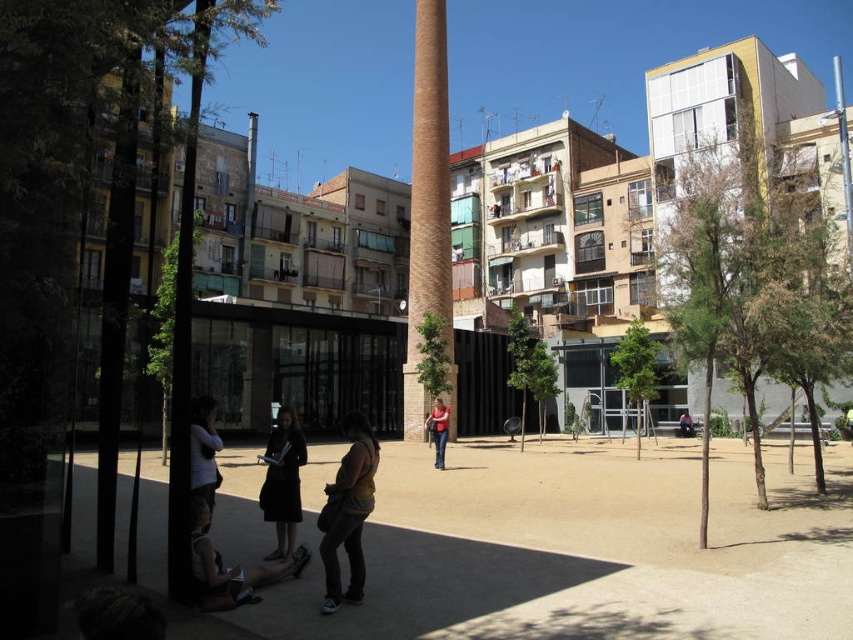
Does dark brown leather shoes at lower center have a lesser height compared to dark matte dress at center?

Indeed, dark brown leather shoes at lower center has a lesser height compared to dark matte dress at center.

Is dark brown leather shoes at lower center taller than dark matte dress at center?

No, dark brown leather shoes at lower center is not taller than dark matte dress at center.

Between point (305, 552) and point (293, 445), which one is positioned behind?

The point (293, 445) is behind.

Where is `dark brown leather shoes at lower center`? This screenshot has height=640, width=853. dark brown leather shoes at lower center is located at coordinates (231, 566).

Does dark brown leather jacket at center appear over dark matte dress at center?

Indeed, dark brown leather jacket at center is positioned over dark matte dress at center.

Where is `dark brown leather jacket at center`? The image size is (853, 640). dark brown leather jacket at center is located at coordinates (347, 513).

Can you confirm if dark matte dress at center is thinner than matte black dress at lower left?

No.

I want to click on dark matte dress at center, so click(x=282, y=481).